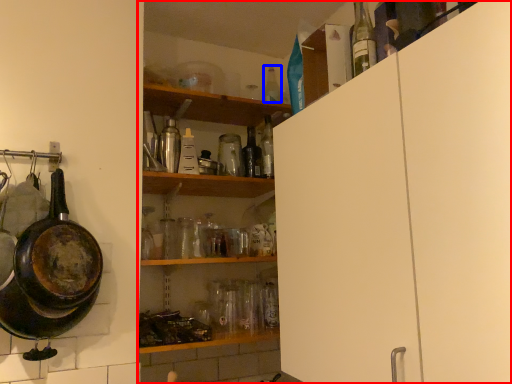
Question: Which object appears farthest to the camera in this image, shelf (highlighted by a red box) or bottle (highlighted by a blue box)?

Choices:
 (A) shelf
 (B) bottle

Answer: (B)